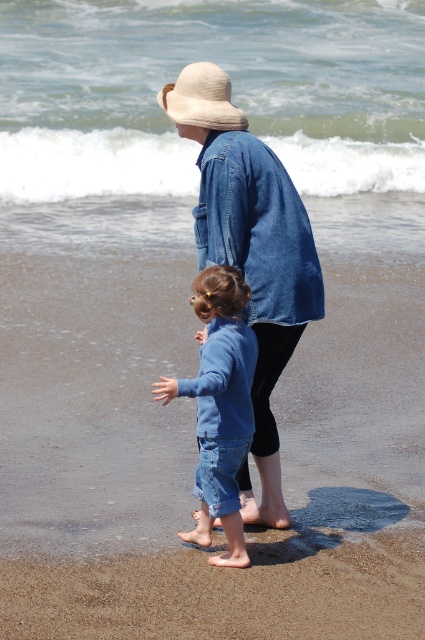
You are a tailor trying to fit a customer for a new jacket and jeans. The customer is wearing a denim jacket at center and blue denim jeans at center. The tailor needs to know which garment has a larger width to ensure proper fitting. Can you determine which one is wider?

The denim jacket at center has a larger width than the blue denim jeans at center, so the tailor should focus on ensuring the jacket has a wider measurement for proper fitting.

You are a photographer trying to capture the perfect shot of the blue denim jeans at center. To ensure the jeans are in the center of the frame, where should you position your camera? Please provide coordinates based on the image grid system where the bottom left corner is the origin point.

The blue denim jeans at center are located at coordinates point (220, 404), so position the camera to center the frame at those coordinates to capture them precisely.